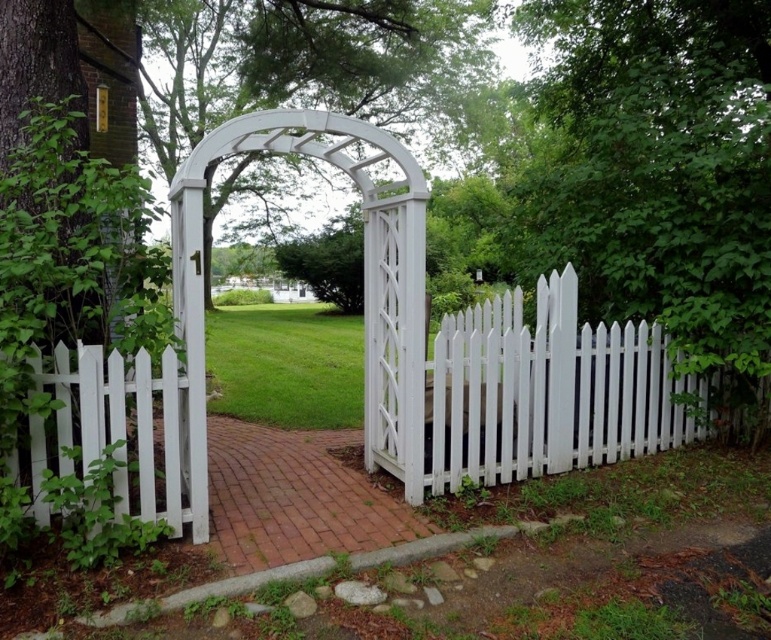
Question: Which object is farther from the camera taking this photo?

Choices:
 (A) white picket fence at center
 (B) white picket fence at left

Answer: (A)

Question: Is white picket fence at center bigger than white picket fence at left?

Choices:
 (A) yes
 (B) no

Answer: (A)

Question: Which point is farther to the camera?

Choices:
 (A) (150, 513)
 (B) (625, 333)

Answer: (B)

Question: Which object appears farthest from the camera in this image?

Choices:
 (A) white picket fence at left
 (B) white picket fence at center

Answer: (B)

Question: Can you confirm if white picket fence at center is positioned above white picket fence at left?

Choices:
 (A) yes
 (B) no

Answer: (A)

Question: In this image, where is white picket fence at center located relative to white picket fence at left?

Choices:
 (A) above
 (B) below

Answer: (A)